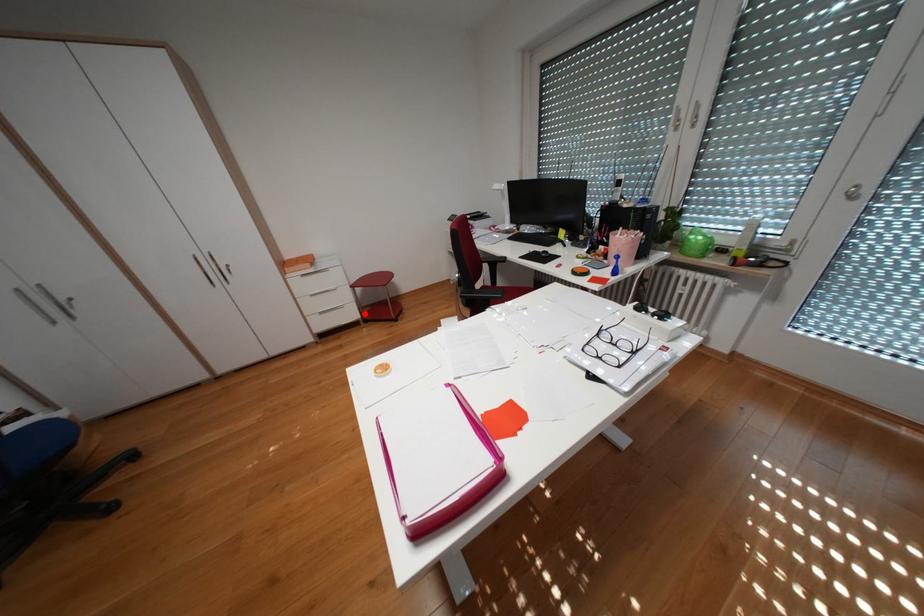
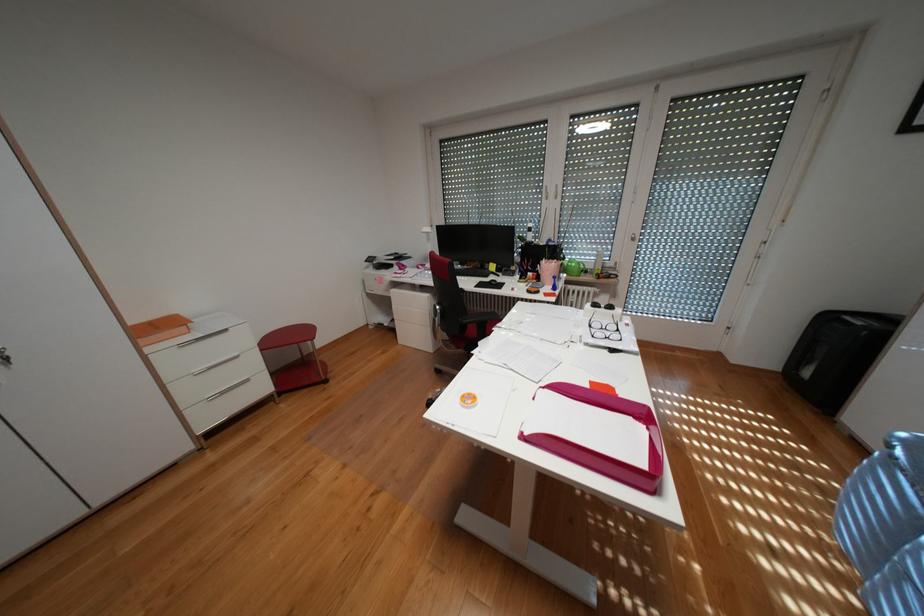
Question: I am providing you with two images of the same scene from different viewpoints. A red point is shown in image1. For the corresponding object point in image2, is it positioned nearer or farther from the camera?

Choices:
 (A) Nearer
 (B) Farther

Answer: (A)